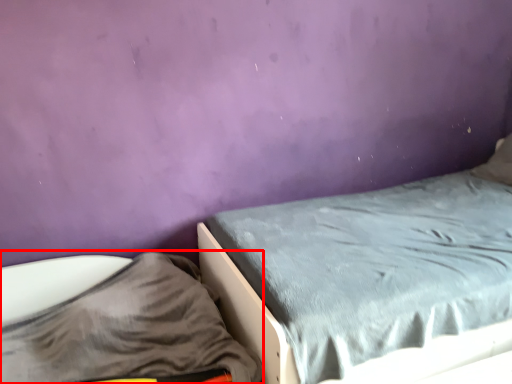
Question: From the image's perspective, considering the relative positions of sheet (annotated by the red box) and bed in the image provided, where is sheet (annotated by the red box) located with respect to the staircase?

Choices:
 (A) above
 (B) below

Answer: (B)